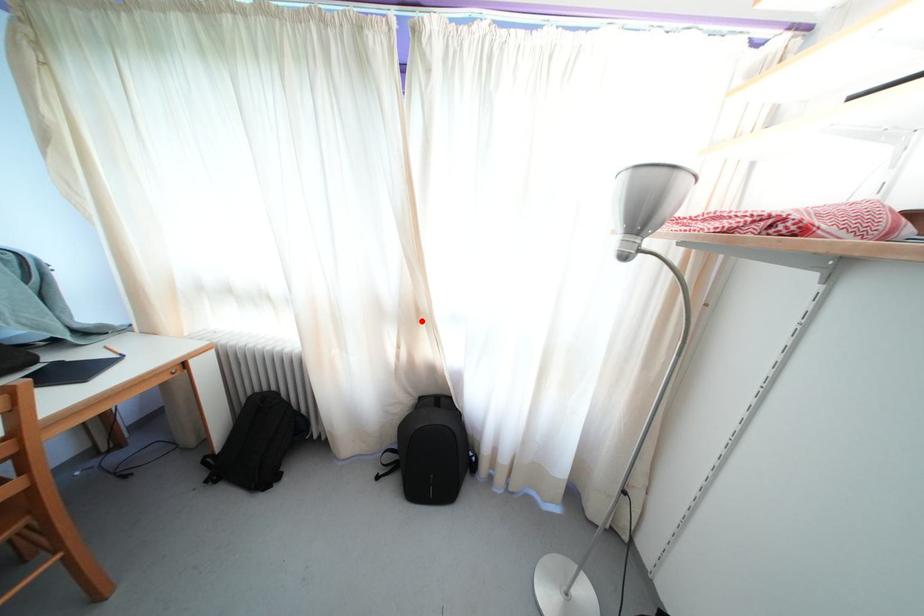
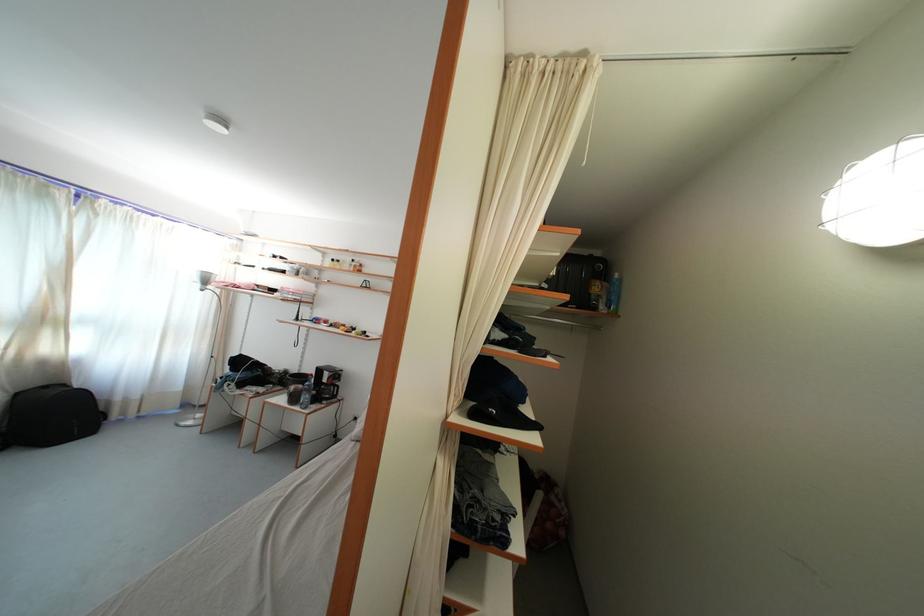
The point at the highlighted location is marked in the first image. Where is the corresponding point in the second image?

(52, 326)